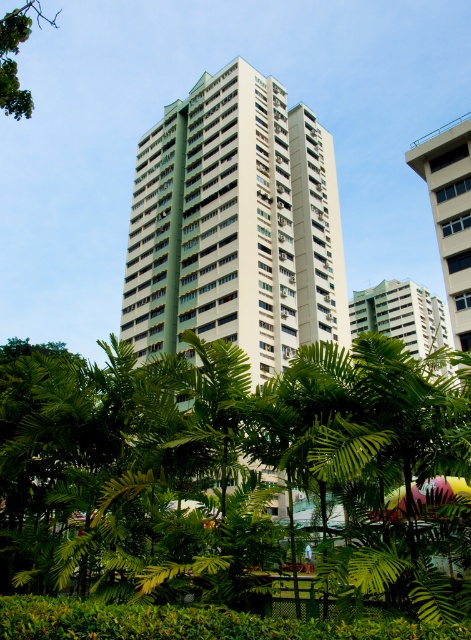
Question: Is green leafy tree at center behind green leafy tree at upper left?

Choices:
 (A) yes
 (B) no

Answer: (B)

Question: Which object is closer to the camera taking this photo?

Choices:
 (A) green leafy tree at upper left
 (B) green leafy tree at center

Answer: (B)

Question: Is green leafy tree at center to the right of green leafy tree at upper left from the viewer's perspective?

Choices:
 (A) yes
 (B) no

Answer: (A)

Question: Which of these objects is positioned closest to the green leafy tree at center?

Choices:
 (A) white concrete building at upper right
 (B) green leafy tree at upper left

Answer: (B)

Question: Does white concrete building at upper right have a smaller size compared to green matte building at upper center?

Choices:
 (A) yes
 (B) no

Answer: (B)

Question: Among these points, which one is nearest to the camera?

Choices:
 (A) (315, 531)
 (B) (8, 64)
 (C) (427, 301)
 (D) (457, 252)

Answer: (A)